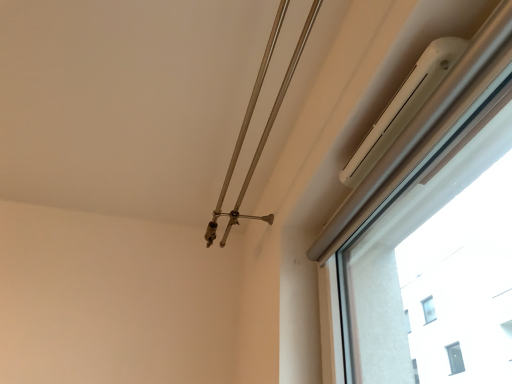
Question: Considering the positions of metallic silver rod at upper center and white plastic air conditioner at upper right in the image, is metallic silver rod at upper center wider or thinner than white plastic air conditioner at upper right?

Choices:
 (A) wide
 (B) thin

Answer: (A)

Question: Is point [x=268, y=46] closer or farther from the camera than point [x=339, y=306]?

Choices:
 (A) closer
 (B) farther

Answer: (A)

Question: Visually, is metallic silver rod at upper center positioned to the left or to the right of white plastic air conditioner at upper right?

Choices:
 (A) left
 (B) right

Answer: (A)

Question: Is white plastic air conditioner at upper right wider or thinner than metallic silver rod at upper center?

Choices:
 (A) wide
 (B) thin

Answer: (B)

Question: Based on their positions, is white plastic air conditioner at upper right located to the left or right of metallic silver rod at upper center?

Choices:
 (A) right
 (B) left

Answer: (A)

Question: In terms of height, does white plastic air conditioner at upper right look taller or shorter compared to metallic silver rod at upper center?

Choices:
 (A) short
 (B) tall

Answer: (A)

Question: From the image's perspective, is white plastic air conditioner at upper right above or below metallic silver rod at upper center?

Choices:
 (A) below
 (B) above

Answer: (B)